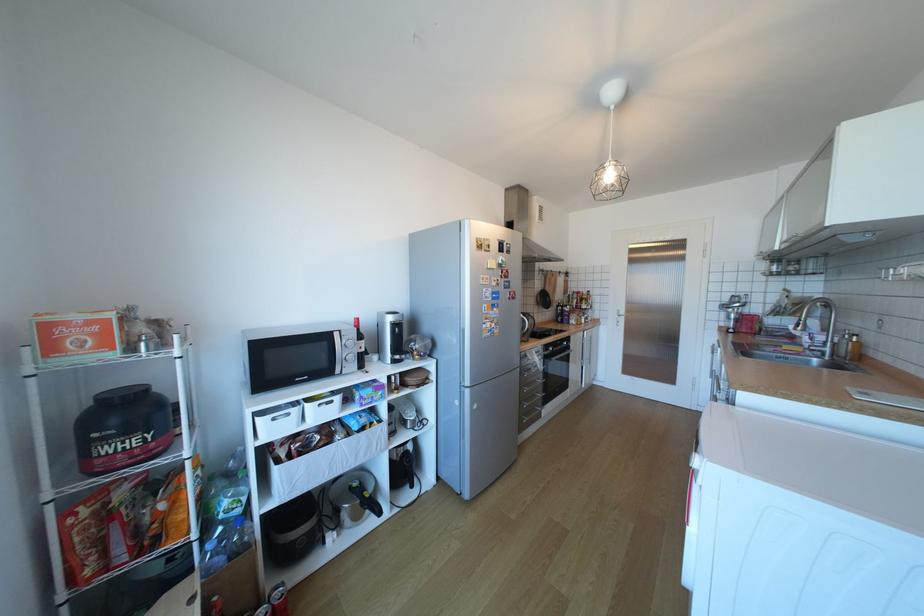
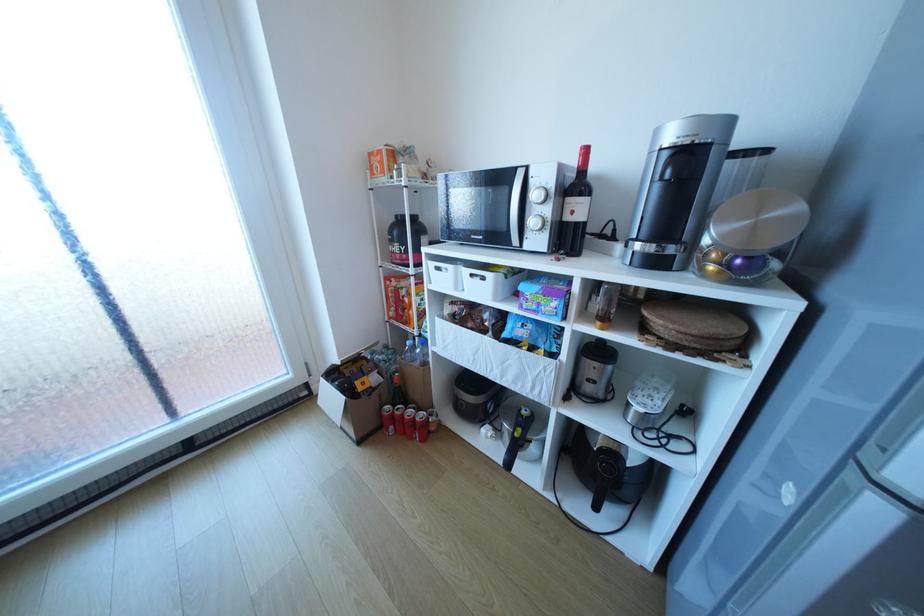
Locate, in the second image, the point that corresponds to pixel 353 522 in the first image.

(513, 434)